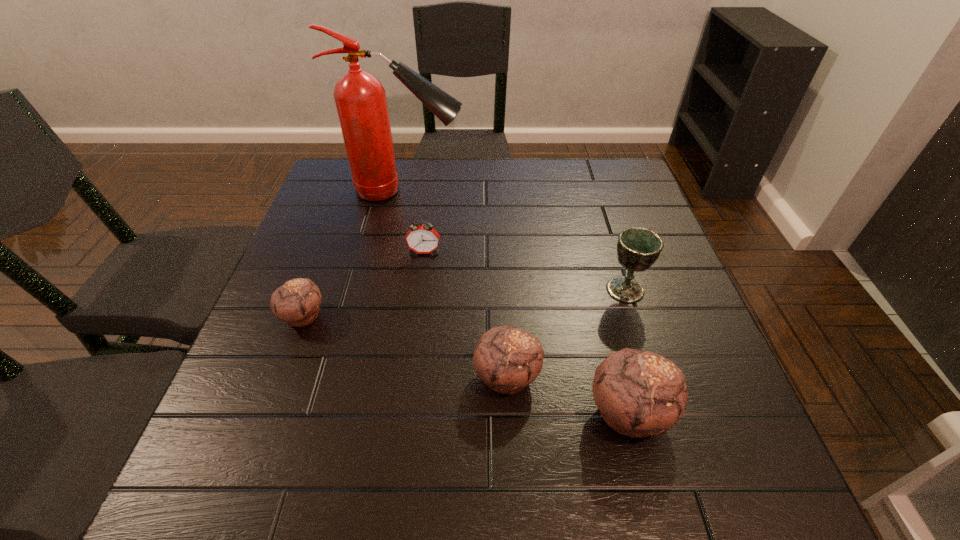
Where is `unoccupied position between the shortest muffin and the fifth nearest object`? Image resolution: width=960 pixels, height=540 pixels. unoccupied position between the shortest muffin and the fifth nearest object is located at coordinates (364, 284).

This screenshot has height=540, width=960. I want to click on vacant space that's between the second muffin from left to right and the alarm clock, so click(x=466, y=314).

Locate an element on the screen. This screenshot has width=960, height=540. free space between the shortest muffin and the tallest muffin is located at coordinates (467, 364).

The image size is (960, 540). What are the coordinates of `empty space between the farthest muffin and the alarm clock` in the screenshot? It's located at pyautogui.click(x=364, y=284).

Where is `empty space between the chalice and the fire extinguisher`? This screenshot has width=960, height=540. empty space between the chalice and the fire extinguisher is located at coordinates (516, 240).

Identify the location of vacant area between the second muffin from right to left and the farthest object. (456, 284).

Choose which object is the fifth nearest neighbor to the chalice. Please provide its 2D coordinates. Your answer should be formatted as a tuple, i.e. [(x, y)], where the tuple contains the x and y coordinates of a point satisfying the conditions above.

[(297, 302)]

Locate which object is the fourth closest to the alarm clock. Please provide its 2D coordinates. Your answer should be formatted as a tuple, i.e. [(x, y)], where the tuple contains the x and y coordinates of a point satisfying the conditions above.

[(638, 248)]

Locate an element on the screen. Image resolution: width=960 pixels, height=540 pixels. muffin that is the third closest one to the tallest object is located at coordinates (639, 393).

Locate an element on the screen. The width and height of the screenshot is (960, 540). muffin object that ranks as the second closest to the second farthest object is located at coordinates (507, 359).